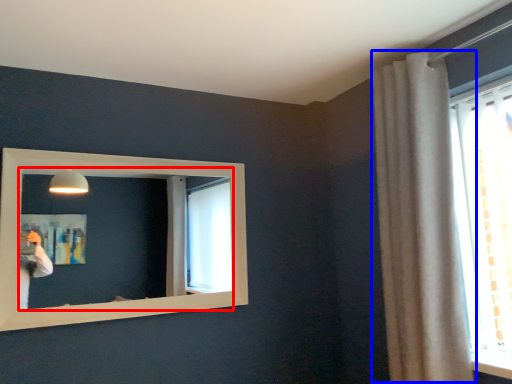
Question: Which of the following is the closest to the observer, mirror (highlighted by a red box) or curtain (highlighted by a blue box)?

Choices:
 (A) mirror
 (B) curtain

Answer: (B)